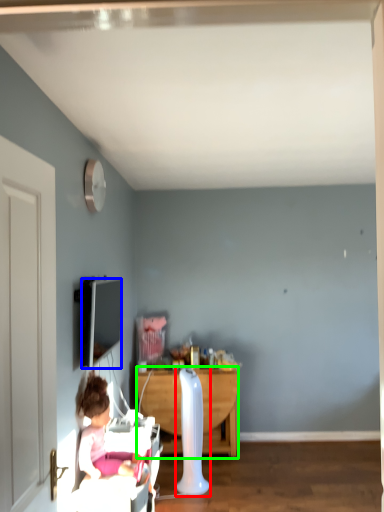
Question: Which object is the closest to the radiator (highlighted by a red box)? Choose among these: television (highlighted by a blue box) or desk (highlighted by a green box).

Choices:
 (A) television
 (B) desk

Answer: (B)